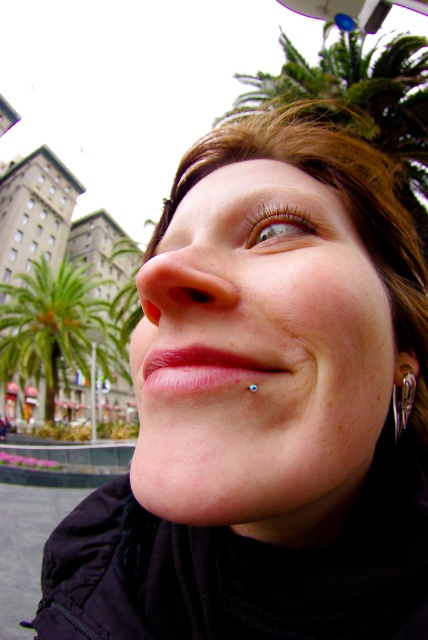
Can you confirm if brown matte eye at upper center is positioned above silver metallic spike at lower right?

Yes, brown matte eye at upper center is above silver metallic spike at lower right.

This screenshot has height=640, width=428. I want to click on brown matte eye at upper center, so click(282, 224).

Is point (276, 218) farther from viewer compared to point (403, 404)?

That is False.

Where is `brown matte eye at upper center`? This screenshot has width=428, height=640. brown matte eye at upper center is located at coordinates (282, 224).

Who is more forward, [62,358] or [410,381]?

Point [410,381] is in front.

Does green leafy palm tree at left appear on the left side of silver metallic spike at lower right?

Yes, green leafy palm tree at left is to the left of silver metallic spike at lower right.

Where is `green leafy palm tree at left`? green leafy palm tree at left is located at coordinates (50, 324).

The image size is (428, 640). What are the coordinates of `green leafy palm tree at left` in the screenshot? It's located at (50, 324).

Between smooth skin face at center and brown matte eye at upper center, which one appears on the right side from the viewer's perspective?

From the viewer's perspective, brown matte eye at upper center appears more on the right side.

Is smooth skin face at center closer to camera compared to brown matte eye at upper center?

Yes.

Image resolution: width=428 pixels, height=640 pixels. Describe the element at coordinates (258, 356) in the screenshot. I see `smooth skin face at center` at that location.

This screenshot has height=640, width=428. I want to click on smooth skin face at center, so click(258, 356).